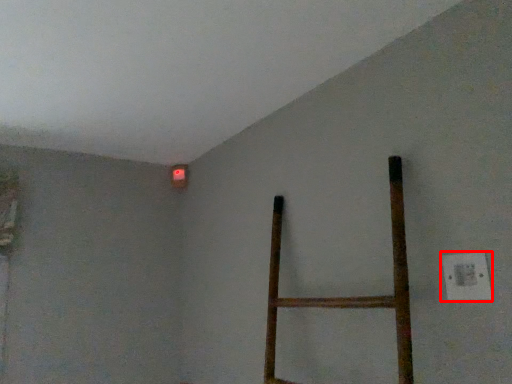
Question: Considering the relative positions of electric outlet (annotated by the red box) and lamp in the image provided, where is electric outlet (annotated by the red box) located with respect to the staircase?

Choices:
 (A) left
 (B) right

Answer: (B)